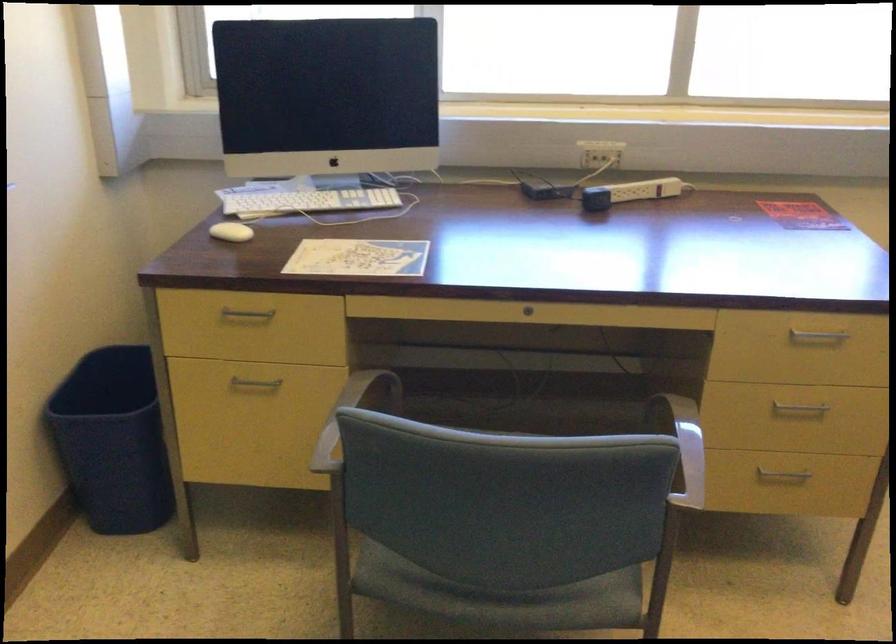
The width and height of the screenshot is (896, 644). Identify the location of white computer mouse. (230, 232).